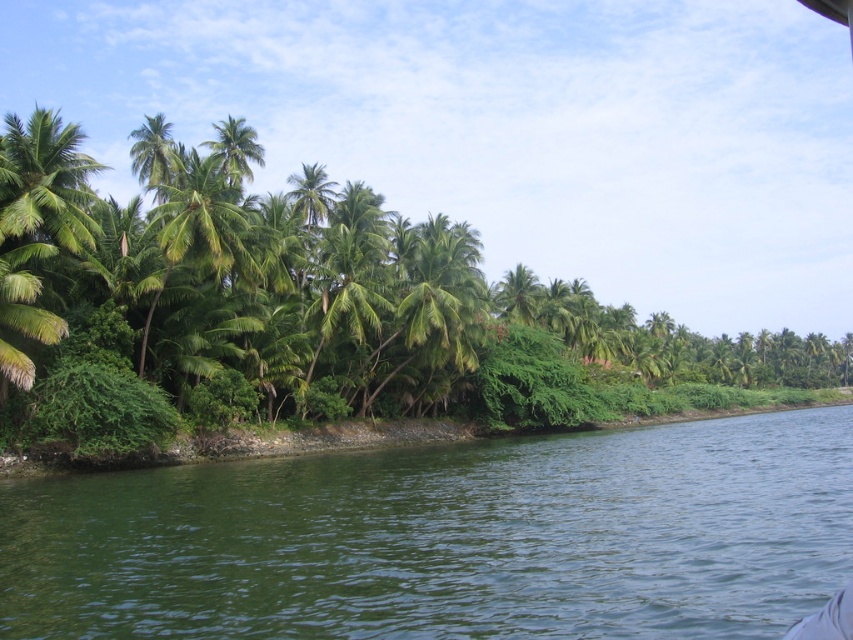
Question: Is green water at lower center to the left of green leafy palm tree at upper center from the viewer's perspective?

Choices:
 (A) no
 (B) yes

Answer: (A)

Question: Does green water at lower center appear on the left side of green leafy palm tree at upper center?

Choices:
 (A) no
 (B) yes

Answer: (A)

Question: Which point is farther to the camera?

Choices:
 (A) (235, 122)
 (B) (604, 518)

Answer: (A)

Question: Among these points, which one is nearest to the camera?

Choices:
 (A) [368, 483]
 (B) [245, 172]

Answer: (A)

Question: Does green water at lower center appear under green leafy palm tree at upper center?

Choices:
 (A) yes
 (B) no

Answer: (A)